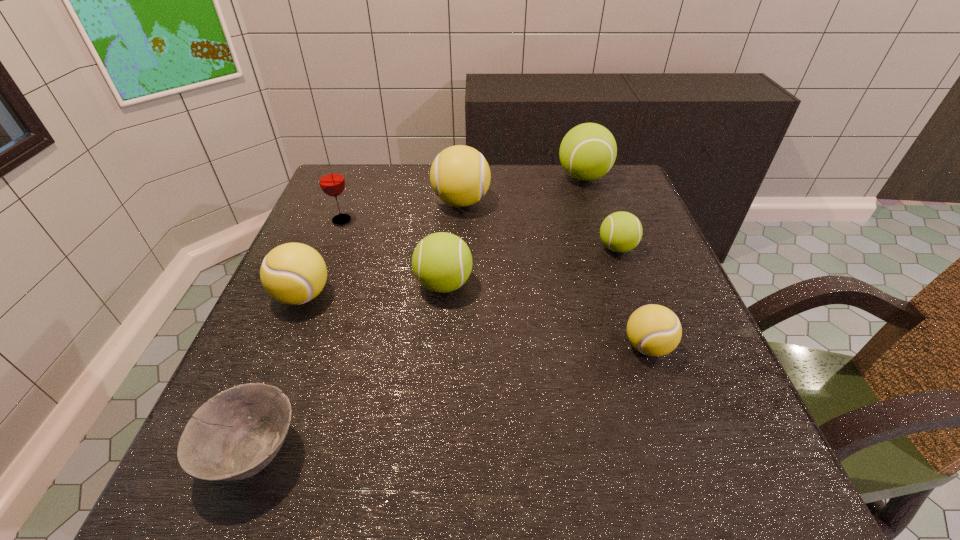
Where is `the biggest green tennis ball`? the biggest green tennis ball is located at coordinates (588, 151).

Where is `the biggest yellow tennis ball`? The image size is (960, 540). the biggest yellow tennis ball is located at coordinates (460, 175).

Where is `the farthest yellow tennis ball`? The width and height of the screenshot is (960, 540). the farthest yellow tennis ball is located at coordinates (460, 175).

Locate an element on the screen. The width and height of the screenshot is (960, 540). glass is located at coordinates (331, 180).

Where is `the leftmost green tennis ball`? The height and width of the screenshot is (540, 960). the leftmost green tennis ball is located at coordinates (441, 262).

Identify the location of the second smallest green tennis ball. The width and height of the screenshot is (960, 540). (441, 262).

Where is `the second nearest yellow tennis ball`? This screenshot has width=960, height=540. the second nearest yellow tennis ball is located at coordinates (293, 273).

At what (x,y) coordinates should I click in order to perform the action: click on the leftmost yellow tennis ball. Please return your answer as a coordinate pair (x, y). This screenshot has width=960, height=540. Looking at the image, I should click on (293, 273).

I want to click on the seventh farthest object, so click(654, 330).

Locate an element on the screen. the rightmost yellow tennis ball is located at coordinates (654, 330).